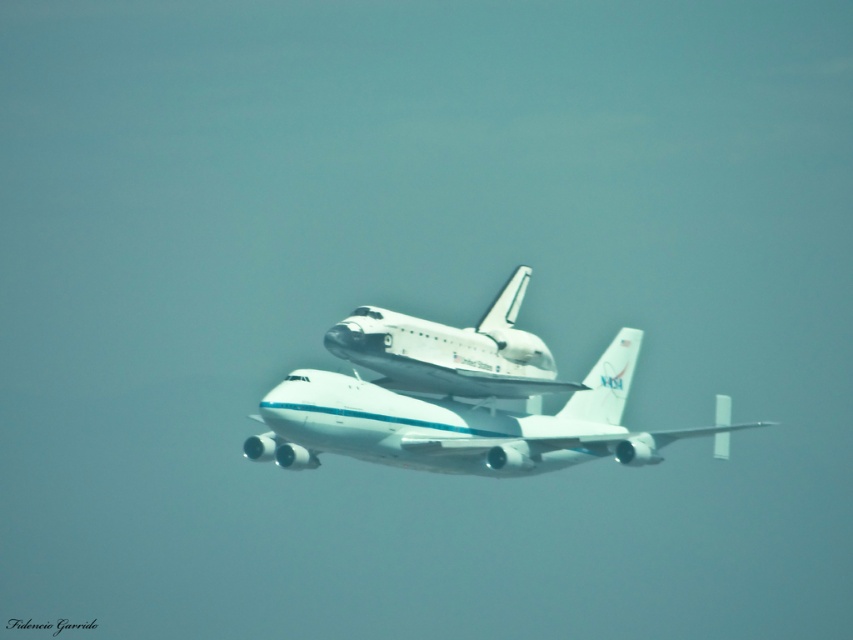
Is white glossy airplane at center to the left of white glossy shuttle at center from the viewer's perspective?

Incorrect, white glossy airplane at center is not on the left side of white glossy shuttle at center.

Is white glossy airplane at center thinner than white glossy shuttle at center?

No, white glossy airplane at center is not thinner than white glossy shuttle at center.

The height and width of the screenshot is (640, 853). Describe the element at coordinates (457, 424) in the screenshot. I see `white glossy airplane at center` at that location.

The height and width of the screenshot is (640, 853). Find the location of `white glossy airplane at center`. white glossy airplane at center is located at coordinates (457, 424).